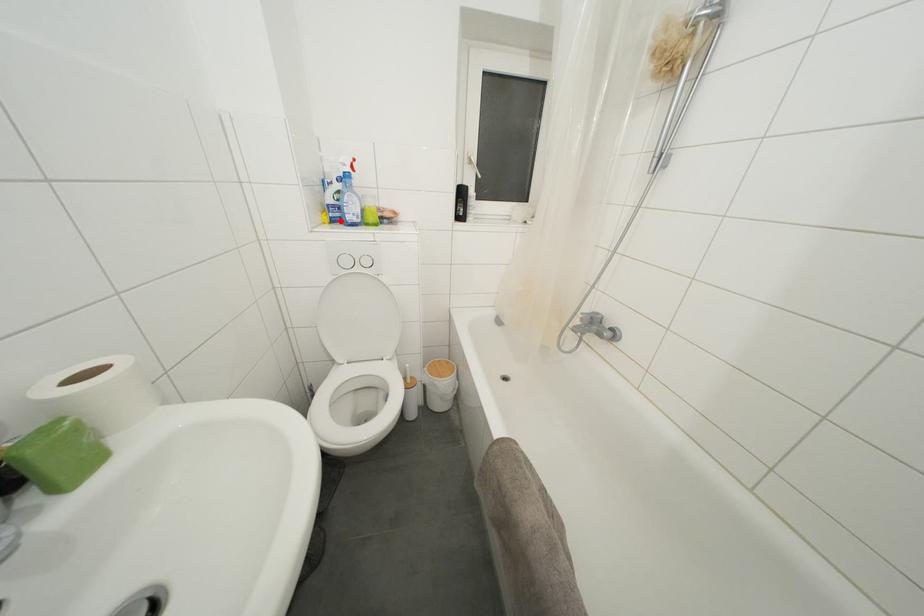
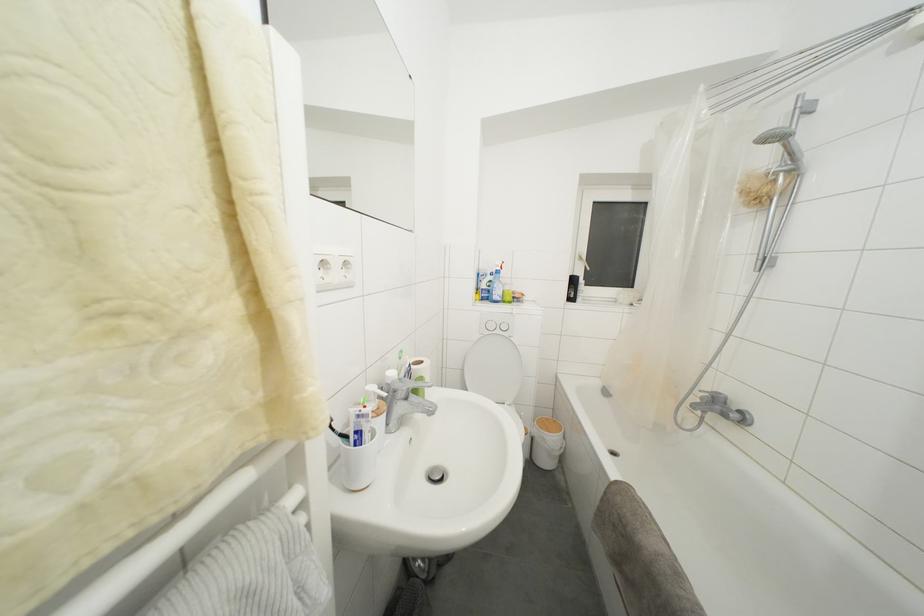
Find the pixel in the second image that matches the highlighted location in the first image.

(490, 301)